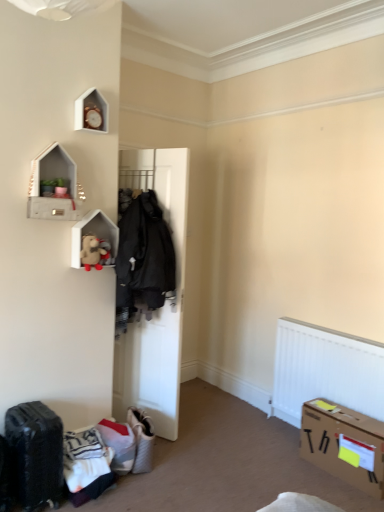
Find the location of `vacant area that lies between white matte door at center and cardboard box at lower right`. vacant area that lies between white matte door at center and cardboard box at lower right is located at coordinates (249, 453).